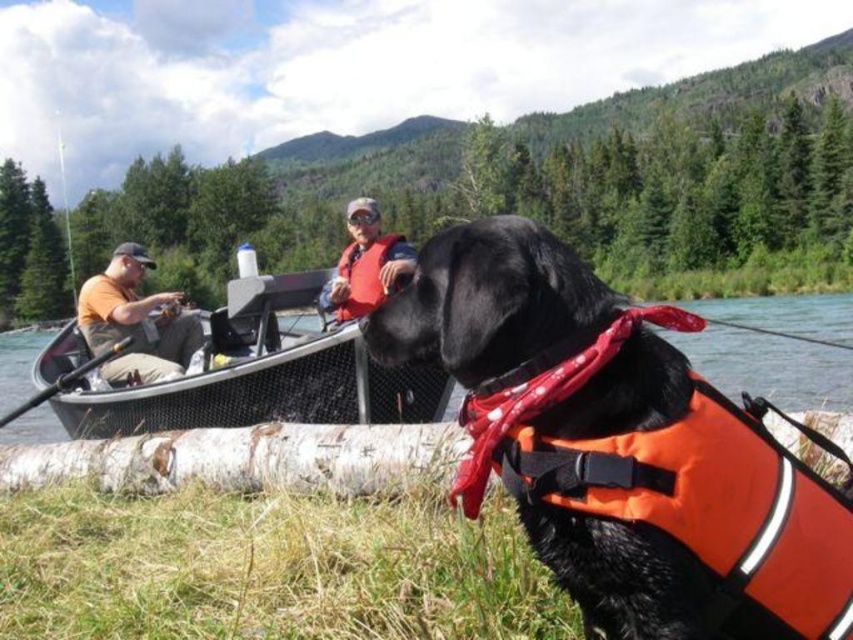
Is the position of shiny orange life vest at center less distant than that of matte orange life vest at center?

Yes, it is.

Between shiny orange life vest at center and matte orange life vest at center, which one is positioned lower?

shiny orange life vest at center

You are a GUI agent. You are given a task and a screenshot of the screen. Output one action in this format:
    pyautogui.click(x=<x>, y=<y>)
    Task: Click on the shiny orange life vest at center
    The height and width of the screenshot is (640, 853).
    Given the screenshot: What is the action you would take?
    pyautogui.click(x=619, y=448)

Find the location of a particular element. The image size is (853, 640). black rubber boat at center is located at coordinates (770, 362).

Is point (38, 422) less distant than point (328, 301)?

No, (38, 422) is behind (328, 301).

What do you see at coordinates (770, 362) in the screenshot? I see `black rubber boat at center` at bounding box center [770, 362].

Where is `black rubber boat at center`? The height and width of the screenshot is (640, 853). black rubber boat at center is located at coordinates (770, 362).

Which is above, shiny orange life vest at center or white bark log at lower left?

Positioned higher is shiny orange life vest at center.

Locate an element on the screen. The height and width of the screenshot is (640, 853). shiny orange life vest at center is located at coordinates (619, 448).

Locate an element on the screen. The width and height of the screenshot is (853, 640). shiny orange life vest at center is located at coordinates (619, 448).